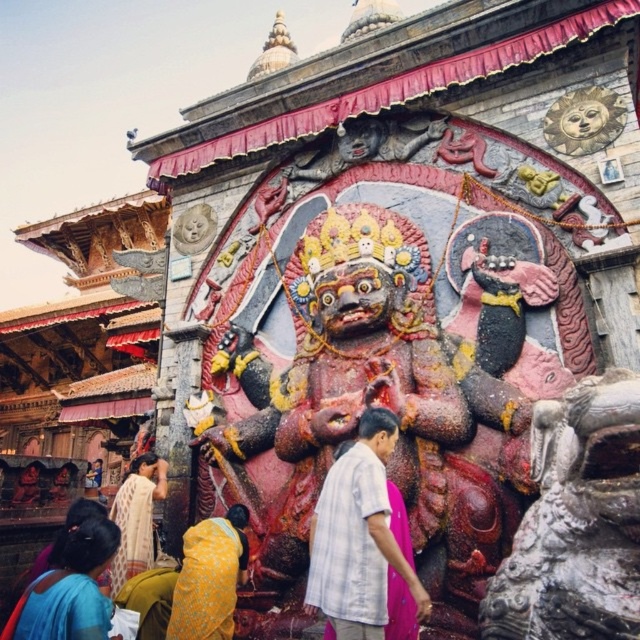
Does point (332, 573) come closer to viewer compared to point (125, 563)?

Yes, it is.

Consider the image. Between white cotton shirt at center and light beige fabric at lower left, which one has more height?

Standing taller between the two is white cotton shirt at center.

Who is more forward, (374, 406) or (122, 568)?

Point (374, 406)

The height and width of the screenshot is (640, 640). In order to click on white cotton shirt at center in this screenshot , I will do `click(358, 536)`.

Who is more distant from viewer, (625, 529) or (364, 442)?

Positioned behind is point (364, 442).

Looking at this image, can you confirm if polished stone statue at center is positioned below white cotton shirt at center?

No, polished stone statue at center is not below white cotton shirt at center.

Looking at this image, measure the distance between point (x=628, y=621) and camera.

A distance of 34.48 meters exists between point (x=628, y=621) and camera.

The width and height of the screenshot is (640, 640). What are the coordinates of `polished stone statue at center` in the screenshot? It's located at (576, 522).

Is point (403, 573) behind point (22, 600)?

That is False.

Who is positioned more to the right, white cotton shirt at center or blue fabric sari at lower left?

white cotton shirt at center

This screenshot has width=640, height=640. I want to click on white cotton shirt at center, so click(358, 536).

The image size is (640, 640). What are the coordinates of `white cotton shirt at center` in the screenshot? It's located at (358, 536).